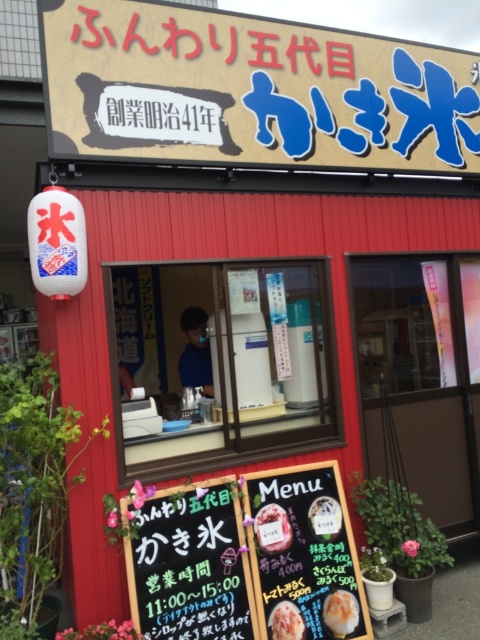
Which is behind, point (284, 509) or point (267, 621)?

Positioned behind is point (284, 509).

Can you confirm if white paper menu at lower center is positioned to the left of smooth pink ice cream at center?

Correct, you'll find white paper menu at lower center to the left of smooth pink ice cream at center.

Locate an element on the screen. The image size is (480, 640). white paper menu at lower center is located at coordinates (273, 529).

You are a GUI agent. You are given a task and a screenshot of the screen. Output one action in this format:
    pyautogui.click(x=<x>, y=<y>)
    Task: Click on the white paper menu at lower center
    This screenshot has width=480, height=640.
    Given the screenshot: What is the action you would take?
    pyautogui.click(x=273, y=529)

How distant is black paper menu at lower center from white paper menu at lower center?

9.21 inches

Which is behind, point (228, 573) or point (262, 540)?

Positioned behind is point (262, 540).

Is point (214, 547) positioned before point (278, 525)?

Yes, it is.

The width and height of the screenshot is (480, 640). In order to click on black paper menu at lower center in this screenshot , I will do `click(240, 557)`.

Which is more to the right, matte cardboard signboard at upper center or white paper menu at lower center?

matte cardboard signboard at upper center

Is matte cardboard signboard at upper center to the left of white paper menu at lower center from the viewer's perspective?

In fact, matte cardboard signboard at upper center is to the right of white paper menu at lower center.

Where is `matte cardboard signboard at upper center`? The image size is (480, 640). matte cardboard signboard at upper center is located at coordinates (251, 90).

Where is `matte cardboard signboard at upper center`? matte cardboard signboard at upper center is located at coordinates (251, 90).